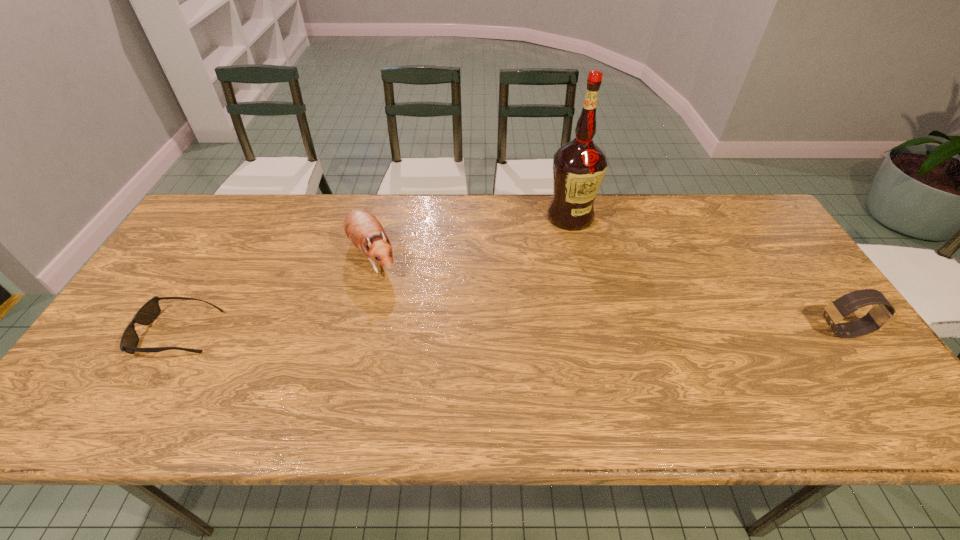
The height and width of the screenshot is (540, 960). I want to click on blank space located 0.230m at the face of the third object from right to left, so click(411, 338).

At what (x,y) coordinates should I click in order to perform the action: click on free space located 0.210m at the face of the third object from right to left. Please return your answer as a coordinate pair (x, y). Looking at the image, I should click on (408, 332).

At what (x,y) coordinates should I click in order to perform the action: click on alcohol that is positioned at the far edge. Please return your answer as a coordinate pair (x, y). Looking at the image, I should click on (579, 166).

At what (x,y) coordinates should I click in order to perform the action: click on hamster present at the far edge. Please return your answer as a coordinate pair (x, y). This screenshot has height=540, width=960. Looking at the image, I should click on (362, 228).

Identify the location of object at the near edge. Image resolution: width=960 pixels, height=540 pixels. (150, 310).

Find the location of a particular element. object present at the left edge is located at coordinates (150, 310).

The height and width of the screenshot is (540, 960). I want to click on object present at the right edge, so click(x=882, y=314).

This screenshot has height=540, width=960. I want to click on object positioned at the near left corner, so click(150, 310).

You are a GUI agent. You are given a task and a screenshot of the screen. Output one action in this format:
    pyautogui.click(x=<x>, y=<y>)
    Task: Click on the free space at the far edge of the desktop
    This screenshot has width=960, height=540.
    Given the screenshot: What is the action you would take?
    pyautogui.click(x=433, y=208)

You are a GUI agent. You are given a task and a screenshot of the screen. Output one action in this format:
    pyautogui.click(x=<x>, y=<y>)
    Task: Click on the vacant space at the near edge of the desktop
    This screenshot has width=960, height=540.
    Given the screenshot: What is the action you would take?
    pyautogui.click(x=749, y=375)